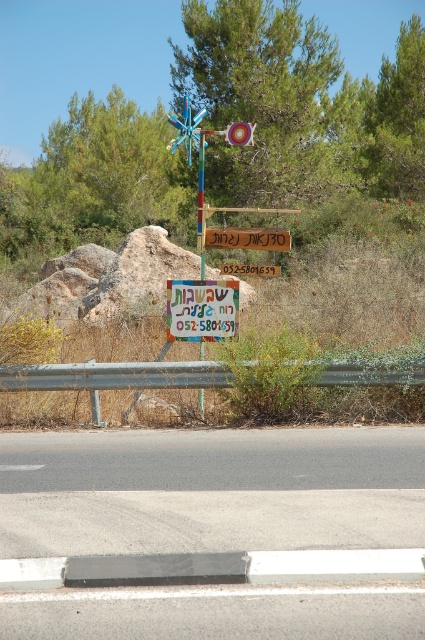
You are driving a car and need to make a U turn. You see the gray asphalt road at center and the wooden sign at center. Which object is closer to your car?

The gray asphalt road at center is closer to the viewer than the wooden sign at center, so the gray asphalt road at center is closer to your car.

You are a delivery driver who needs to make a quick stop. You see the gray asphalt road at center and the wooden sign at center. Which one has a narrower width?

The gray asphalt road at center is thinner than the wooden sign at center, so the gray asphalt road at center has a narrower width.